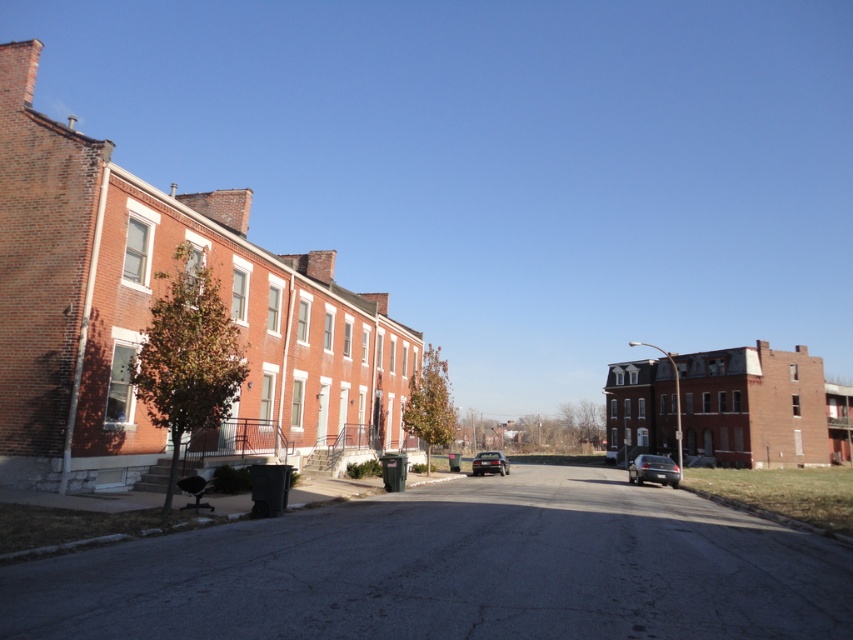
Between point (657, 456) and point (498, 461), which one is positioned in front?

Point (498, 461)

Can you confirm if satin silver sedan at center-right is taller than shiny black sedan at center?

Correct, satin silver sedan at center-right is much taller as shiny black sedan at center.

Is point (650, 464) closer to viewer compared to point (480, 468)?

Yes, it is in front of point (480, 468).

Locate an element on the screen. This screenshot has width=853, height=640. satin silver sedan at center-right is located at coordinates pos(653,468).